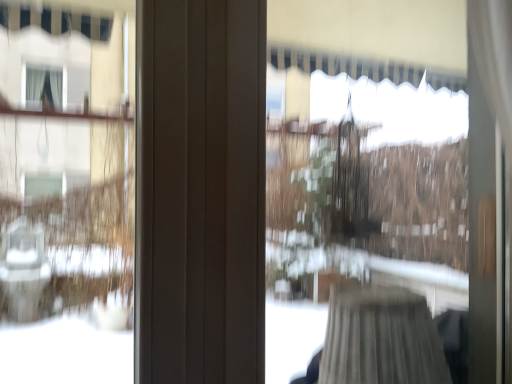
What do you see at coordinates (356, 185) in the screenshot?
I see `transparent glass window at center` at bounding box center [356, 185].

Find the location of `transparent glass window at center`. transparent glass window at center is located at coordinates click(x=356, y=185).

Where is `transparent glass window at center`? This screenshot has width=512, height=384. transparent glass window at center is located at coordinates coord(356,185).